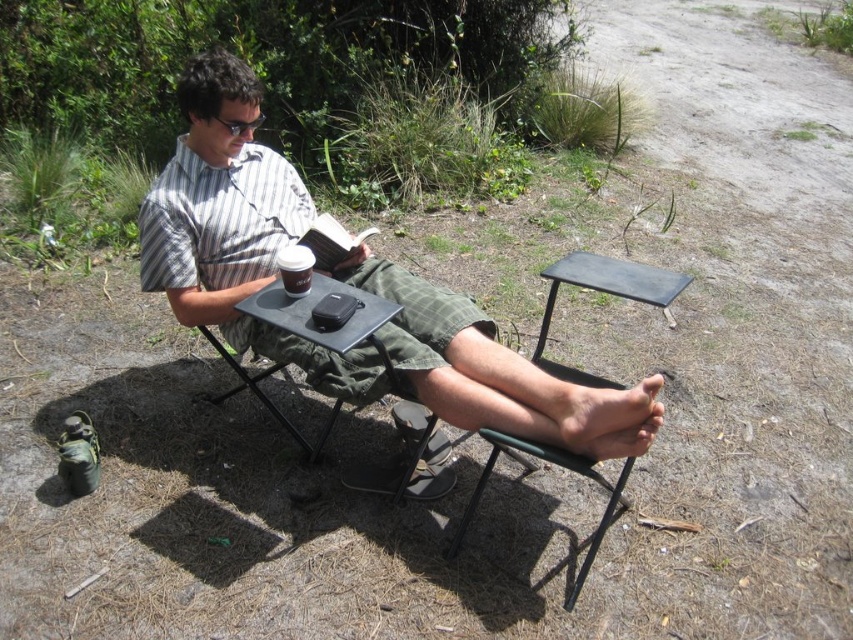
You are a GUI agent. You are given a task and a screenshot of the screen. Output one action in this format:
    pyautogui.click(x=<x>, y=<y>)
    Task: Click on the matte black phone at center
    The image size is (853, 640).
    Given the screenshot: What is the action you would take?
    click(x=235, y=227)

Which is in front, point (207, 161) or point (646, 301)?

Point (646, 301) is in front.

Looking at this image, who is more distant from viewer, (535,387) or (502,440)?

The point (535,387) is more distant.

Identify the location of matte black phone at center. The width and height of the screenshot is (853, 640). (235, 227).

Does matte black phone at center lie in front of hardcover book at center?

That is True.

Is matte black phone at center thinner than hardcover book at center?

Incorrect, matte black phone at center's width is not less than hardcover book at center's.

Which is in front, point (469, 314) or point (305, 232)?

Point (469, 314) is in front.

I want to click on matte black phone at center, so click(x=235, y=227).

Which is more to the right, hardcover book at center or white paper cup at center?

hardcover book at center is more to the right.

The image size is (853, 640). Find the location of `hardcover book at center`. hardcover book at center is located at coordinates (331, 241).